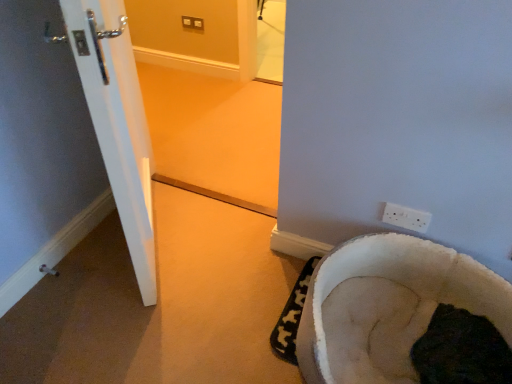
This screenshot has width=512, height=384. Find the location of `vacant space situated on the left part of dark fur bed at lower right`. vacant space situated on the left part of dark fur bed at lower right is located at coordinates coord(381,338).